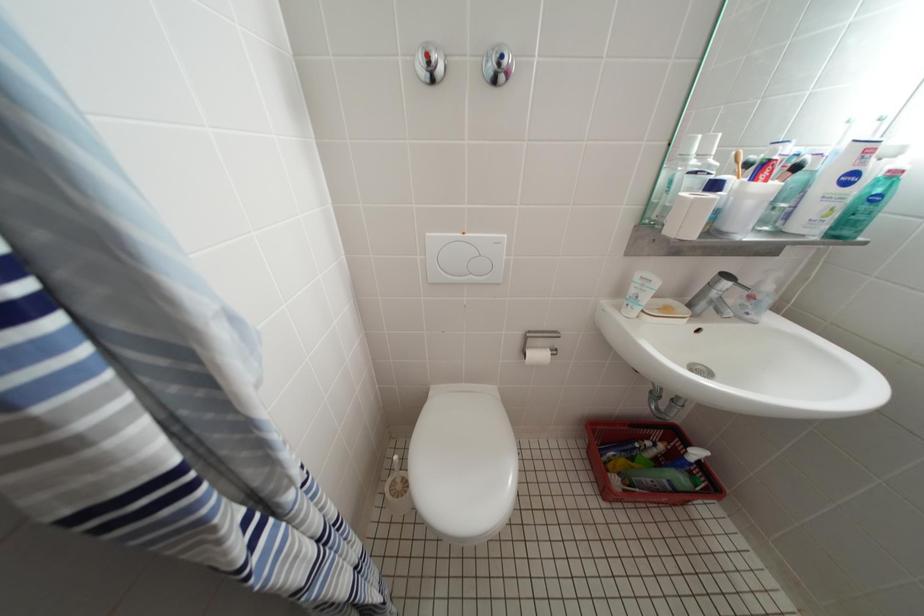
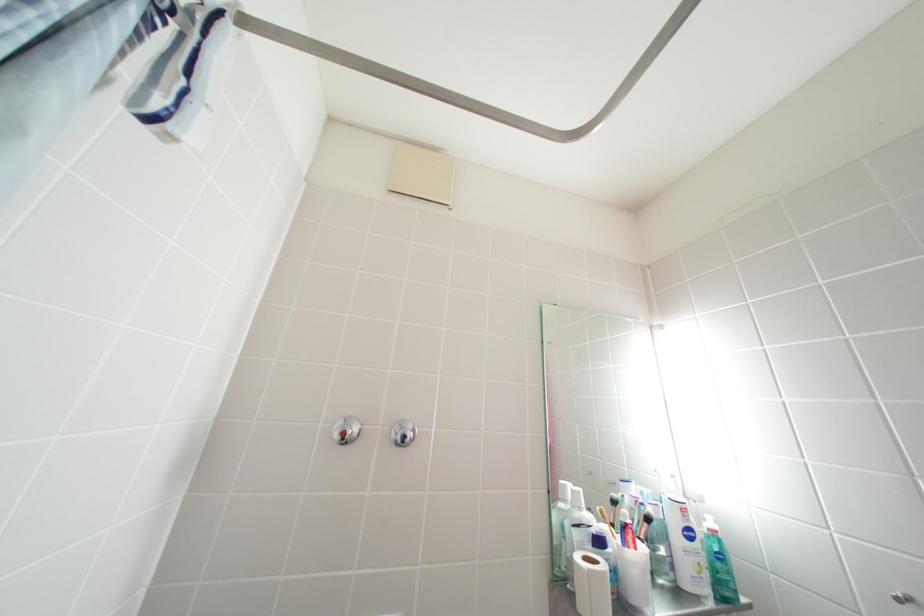
The images are taken continuously from a first-person perspective. In which direction is your viewpoint rotating?

The camera rotated toward right-up.